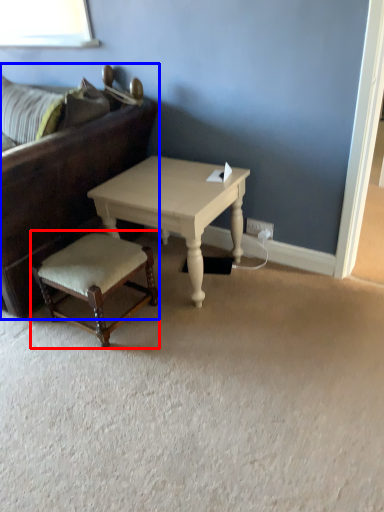
Question: Which object appears farthest to the camera in this image, stool (highlighted by a red box) or studio couch (highlighted by a blue box)?

Choices:
 (A) stool
 (B) studio couch

Answer: (A)